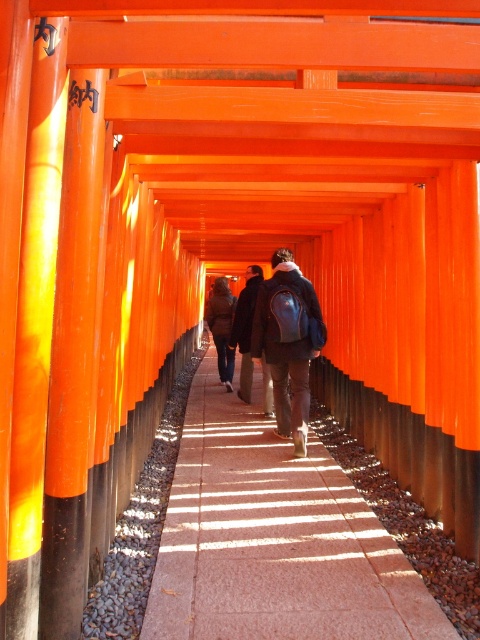
You are standing at the entrance of the torii gate pathway and see the smooth stone pavement at center and the dark brown leather jacket at center. Which object is positioned to the right of the other?

The smooth stone pavement at center is to the right of the dark brown leather jacket at center.

In the scene shown: You are standing at the entrance of the torii gate pathway and see the smooth stone pavement at center and the matte black backpack at center. Which object is positioned to the left of the other?

The smooth stone pavement at center is to the left of the matte black backpack at center.